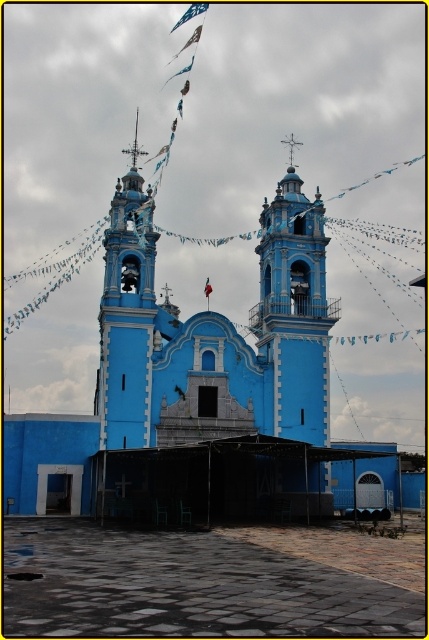
The height and width of the screenshot is (640, 429). Identify the location of blue painted stone church at center. (187, 355).

Is blue painted stone church at center behind matte blue bell tower at center?

No, it is in front of matte blue bell tower at center.

Locate an element on the screen. This screenshot has width=429, height=640. blue painted stone church at center is located at coordinates (187, 355).